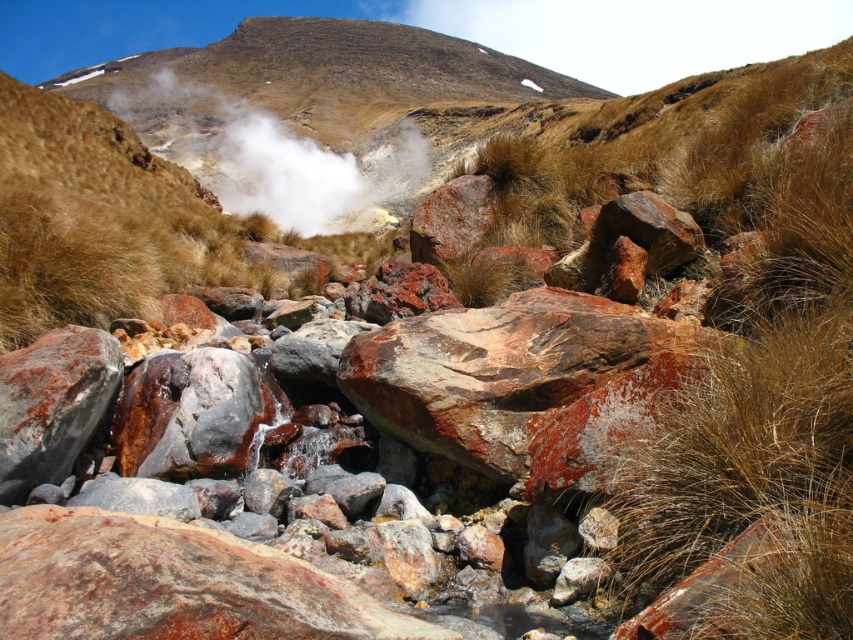
From the picture: Does rusty rock at center have a lesser height compared to white vapor at center?

Correct, rusty rock at center is not as tall as white vapor at center.

Does rusty rock at center have a larger size compared to white vapor at center?

Actually, rusty rock at center might be smaller than white vapor at center.

Locate an element on the screen. Image resolution: width=853 pixels, height=640 pixels. rusty rock at center is located at coordinates (524, 381).